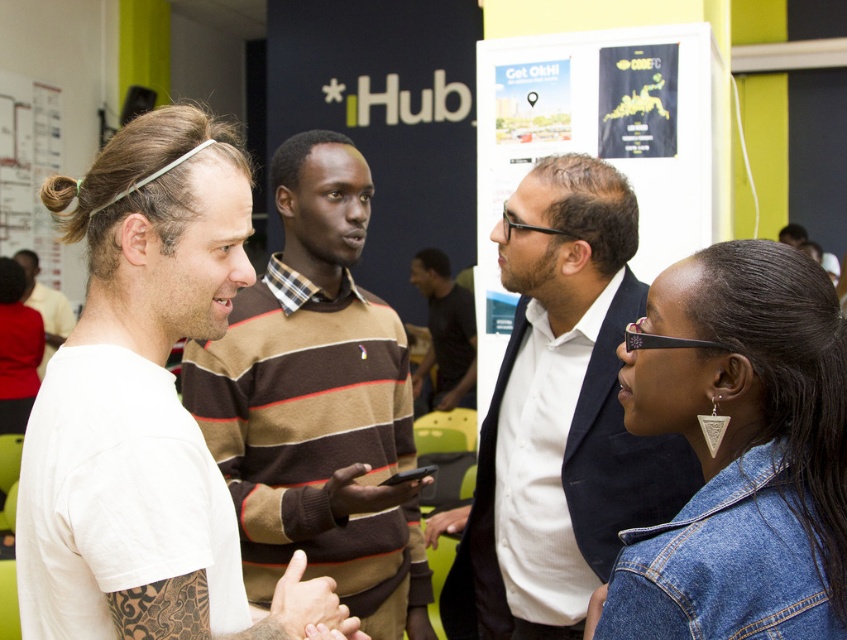
Does point (519, 627) come in front of point (39, 365)?

Yes, point (519, 627) is in front of point (39, 365).

Which of these two, dark blue suit at center or white t-shirt at left, stands shorter?

With less height is white t-shirt at left.

What do you see at coordinates (560, 417) in the screenshot? I see `dark blue suit at center` at bounding box center [560, 417].

At what (x,y) coordinates should I click in order to perform the action: click on dark blue suit at center. Please return your answer as a coordinate pair (x, y). This screenshot has height=640, width=847. Looking at the image, I should click on (560, 417).

Can you confirm if dark blue suit at center is bigger than black matte shirt at center?

Actually, dark blue suit at center might be smaller than black matte shirt at center.

Does dark blue suit at center have a greater width compared to black matte shirt at center?

Yes, dark blue suit at center is wider than black matte shirt at center.

Which is behind, point (464, 588) or point (425, 296)?

The point (425, 296) is behind.

Locate an element on the screen. dark blue suit at center is located at coordinates pyautogui.click(x=560, y=417).

Can you confirm if white t-shirt at center is thinner than denim jacket at lower right?

Incorrect, white t-shirt at center's width is not less than denim jacket at lower right's.

Who is lower down, white t-shirt at center or denim jacket at lower right?

denim jacket at lower right is lower down.

Identify the location of white t-shirt at center. The image size is (847, 640). (145, 406).